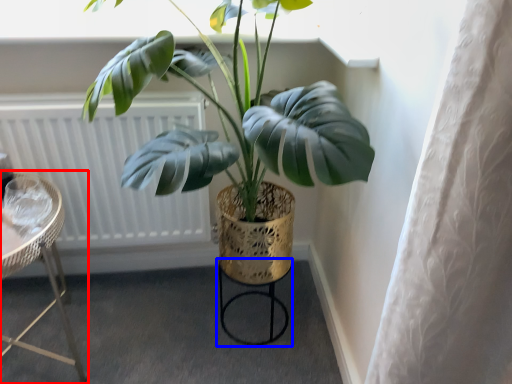
Question: Which object appears closest to the camera in this image, furniture (highlighted by a red box) or bar stool (highlighted by a blue box)?

Choices:
 (A) furniture
 (B) bar stool

Answer: (A)